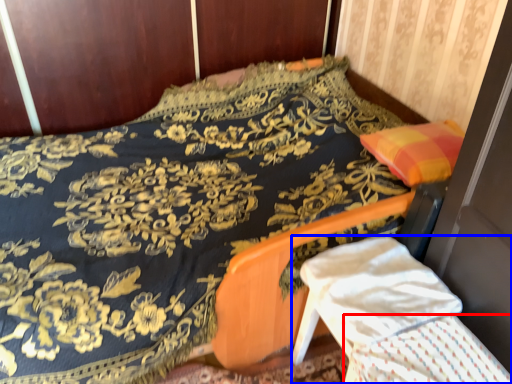
Question: Which object is closer to the camera taking this photo, blanket (highlighted by a red box) or armchair (highlighted by a blue box)?

Choices:
 (A) blanket
 (B) armchair

Answer: (A)